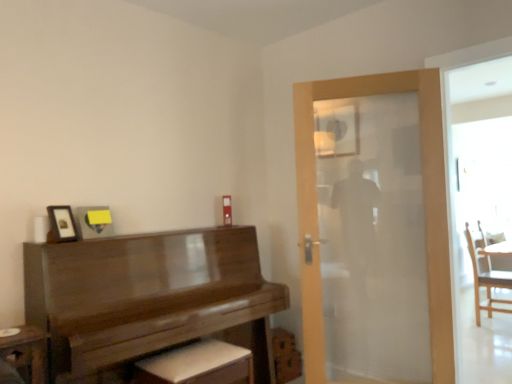
Question: Is white leather footrest at lower center bigger than wooden chair at right?

Choices:
 (A) yes
 (B) no

Answer: (B)

Question: Is white leather footrest at lower center to the left of wooden chair at right from the viewer's perspective?

Choices:
 (A) yes
 (B) no

Answer: (A)

Question: Is white leather footrest at lower center aimed at wooden chair at right?

Choices:
 (A) yes
 (B) no

Answer: (B)

Question: Is white leather footrest at lower center not close to wooden chair at right?

Choices:
 (A) yes
 (B) no

Answer: (A)

Question: Does white leather footrest at lower center have a lesser height compared to wooden chair at right?

Choices:
 (A) yes
 (B) no

Answer: (A)

Question: Is white leather footrest at lower center outside of wooden chair at right?

Choices:
 (A) no
 (B) yes

Answer: (B)

Question: Is matte glass mirror at upper center taller than wooden piano at left?

Choices:
 (A) no
 (B) yes

Answer: (A)

Question: From a real-world perspective, does matte glass mirror at upper center stand above wooden piano at left?

Choices:
 (A) no
 (B) yes

Answer: (B)

Question: Is matte glass mirror at upper center bigger than wooden piano at left?

Choices:
 (A) no
 (B) yes

Answer: (A)

Question: Is matte glass mirror at upper center wider than wooden piano at left?

Choices:
 (A) yes
 (B) no

Answer: (B)

Question: Does matte glass mirror at upper center have a lesser height compared to wooden piano at left?

Choices:
 (A) no
 (B) yes

Answer: (B)

Question: From a real-world perspective, does matte glass mirror at upper center sit lower than wooden piano at left?

Choices:
 (A) yes
 (B) no

Answer: (B)

Question: From the image's perspective, does matte glass mirror at upper center appear lower than matte black picture frame at upper left?

Choices:
 (A) yes
 (B) no

Answer: (B)